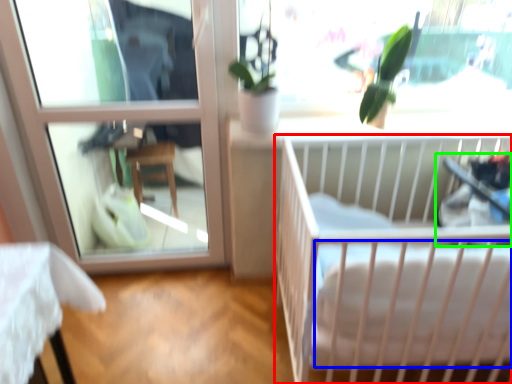
Question: Considering the real-world distances, which object is farthest from infant bed (highlighted by a red box)? mattress (highlighted by a blue box) or baby carriage (highlighted by a green box)?

Choices:
 (A) mattress
 (B) baby carriage

Answer: (B)